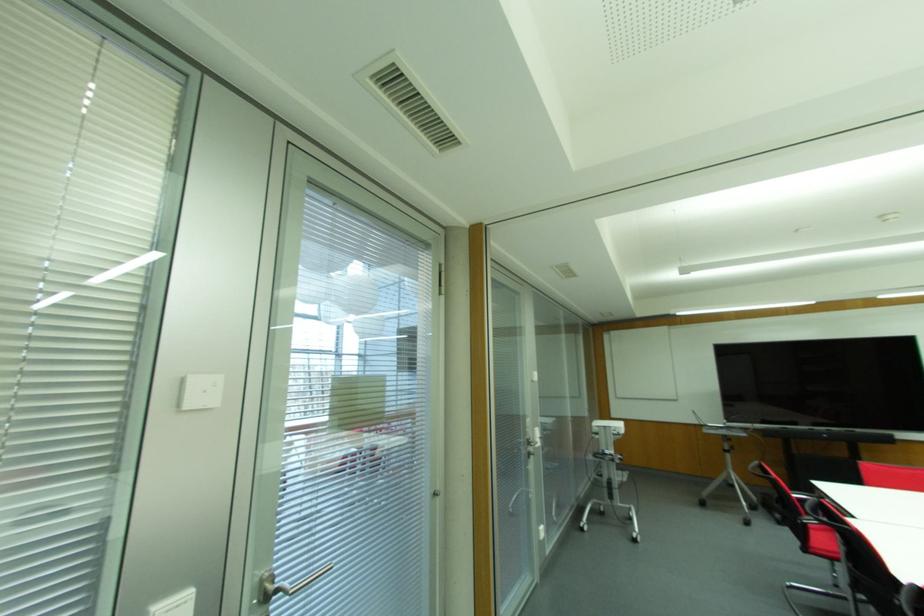
At what (x,y) coordinates should I click in order to perform the action: click on black chair armrest. Please return your answer as a coordinate pair (x, y). Looking at the image, I should click on (799, 496).